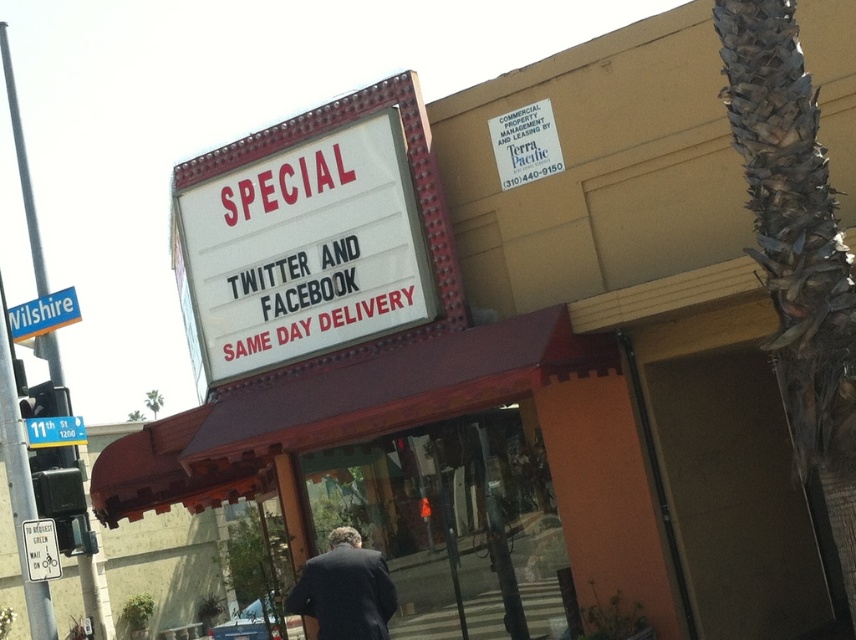
Who is taller, dark blue suit at center or white matte sign at upper center?

With more height is dark blue suit at center.

Is point (330, 582) positioned after point (57, 433)?

No, it is not.

Is point (351, 566) positioned in front of point (62, 442)?

Yes, it is.

I want to click on dark blue suit at center, so click(345, 589).

Is white plastic marquee sign at upper center closer to the viewer compared to white matte sign at upper center?

Yes, it is.

Where is `white plastic marquee sign at upper center`? This screenshot has width=856, height=640. white plastic marquee sign at upper center is located at coordinates (301, 252).

Can you confirm if dark blue suit at center is bigger than white plastic street sign at lower left?

Actually, dark blue suit at center might be smaller than white plastic street sign at lower left.

Between dark blue suit at center and white plastic street sign at lower left, which one is positioned higher?

white plastic street sign at lower left

Which is in front, point (373, 561) or point (37, 298)?

Positioned in front is point (373, 561).

In order to click on dark blue suit at center in this screenshot , I will do `click(345, 589)`.